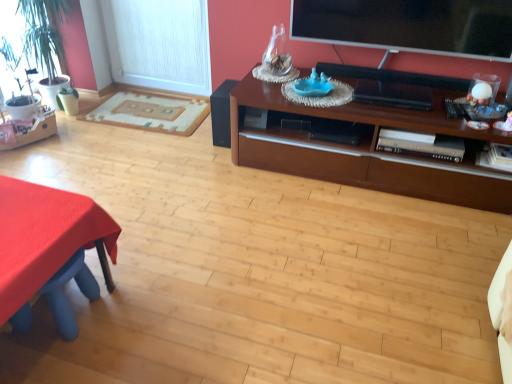
You are a GUI agent. You are given a task and a screenshot of the screen. Output one action in this format:
    pyautogui.click(x=<x>, y=<y>)
    Task: Click on the vacant area that lies in front of beige woven rug at left
    
    Given the screenshot: What is the action you would take?
    pyautogui.click(x=123, y=157)